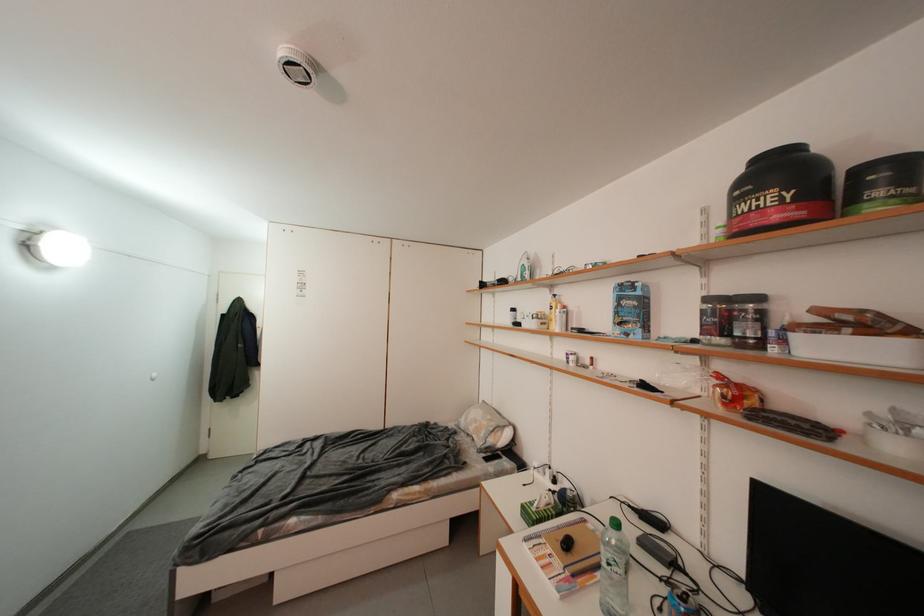
The height and width of the screenshot is (616, 924). Find the location of `black creatine container`. black creatine container is located at coordinates (781, 191).